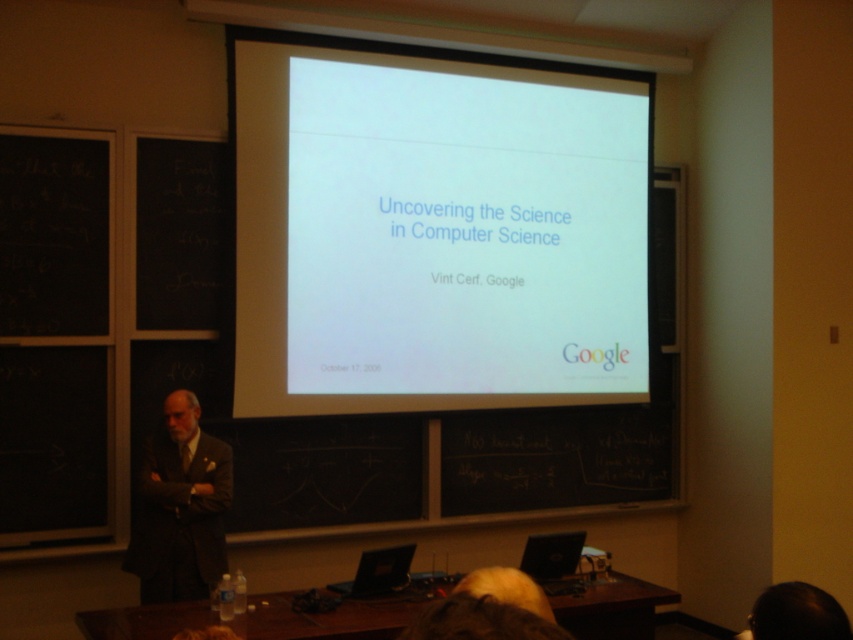
Question: Which object is positioned closest to the dark hair at upper center?

Choices:
 (A) brown woolen suit at left
 (B) blonde hair at lower center
 (C) white matte projector screen at upper center

Answer: (B)

Question: Can you confirm if dark hair at upper center is positioned above blonde hair at lower center?

Choices:
 (A) yes
 (B) no

Answer: (B)

Question: Does white matte projector screen at upper center appear over blonde hair at lower center?

Choices:
 (A) no
 (B) yes

Answer: (B)

Question: Is white matte projector screen at upper center closer to camera compared to brown woolen suit at left?

Choices:
 (A) yes
 (B) no

Answer: (B)

Question: Estimate the real-world distances between objects in this image. Which object is farther from the blonde hair at lower center?

Choices:
 (A) white matte projector screen at upper center
 (B) dark hair at upper center

Answer: (A)

Question: Which point appears farthest from the camera in this image?

Choices:
 (A) (515, 150)
 (B) (480, 593)

Answer: (A)